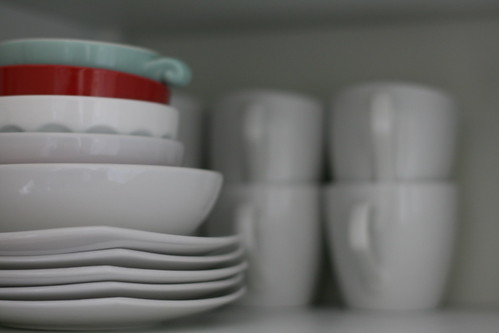
Locate an element on the screen. This screenshot has height=333, width=499. mug is located at coordinates (198, 122), (298, 143), (412, 139), (294, 218), (411, 233).